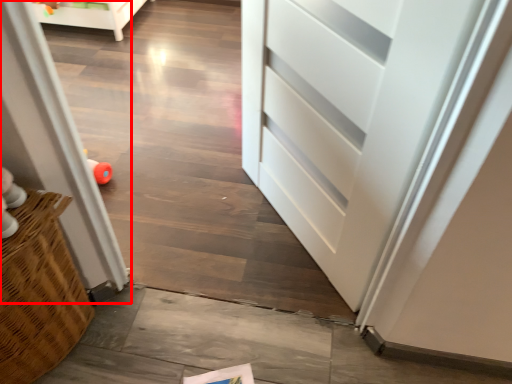
Question: From the image's perspective, what is the correct spatial positioning of screen door (annotated by the red box) in reference to toy?

Choices:
 (A) above
 (B) below

Answer: (B)